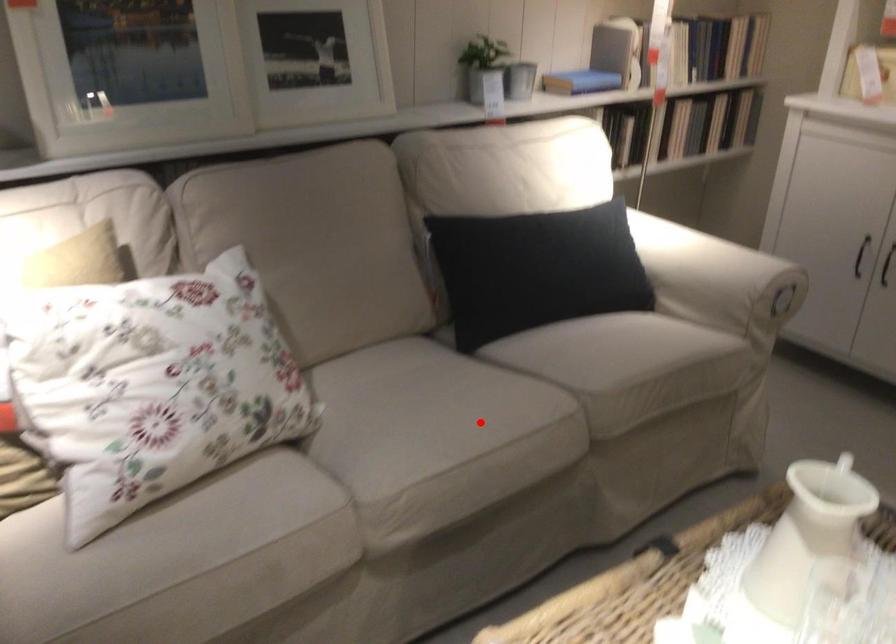
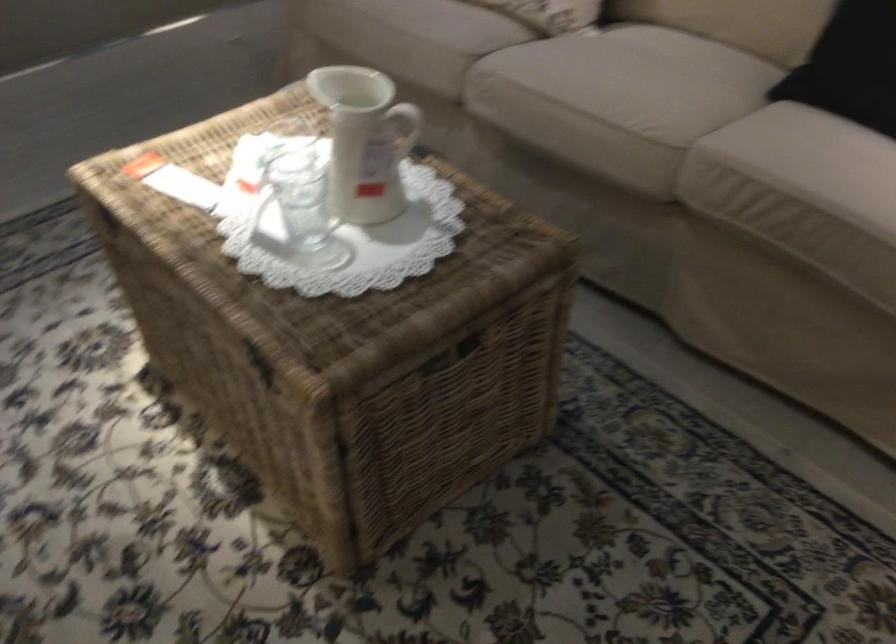
Question: I am providing you with two images of the same scene from different viewpoints. A red point is marked on the first image. Can you still see the location of the red point in image 2?

Choices:
 (A) Yes
 (B) No

Answer: (A)